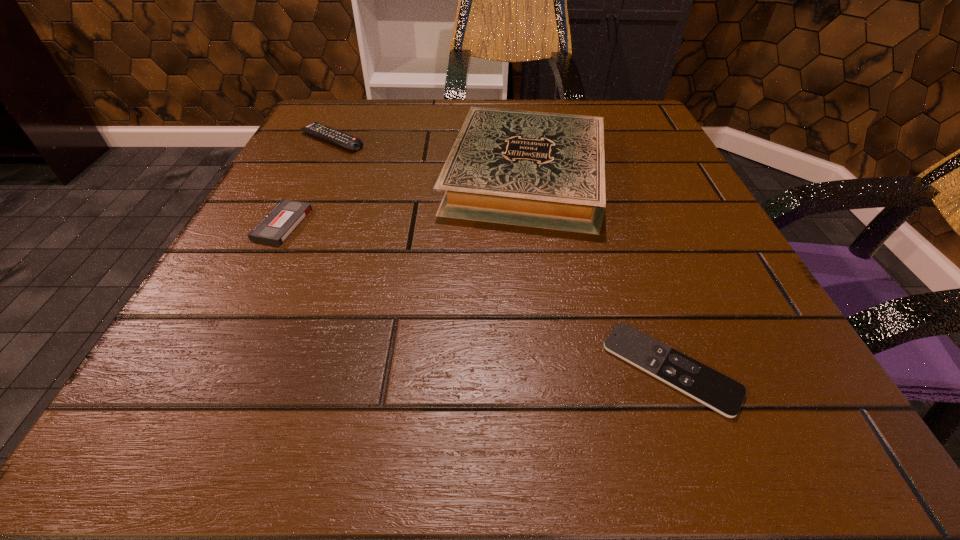
The image size is (960, 540). Identify the location of hardback book at the far edge. (545, 170).

The height and width of the screenshot is (540, 960). Find the location of `remote control that is at the far edge`. remote control that is at the far edge is located at coordinates (346, 141).

The height and width of the screenshot is (540, 960). What are the coordinates of `object present at the near edge` in the screenshot? It's located at (713, 389).

Locate an element on the screen. The image size is (960, 540). remote control located at the left edge is located at coordinates (346, 141).

At what (x,y) coordinates should I click in order to perform the action: click on videotape that is at the left edge. Please return your answer as a coordinate pair (x, y). This screenshot has height=540, width=960. Looking at the image, I should click on click(283, 219).

At what (x,y) coordinates should I click in order to perform the action: click on hardback book that is at the right edge. Please return your answer as a coordinate pair (x, y). Looking at the image, I should click on pyautogui.click(x=545, y=170).

Locate an element on the screen. The width and height of the screenshot is (960, 540). remote control positioned at the right edge is located at coordinates (713, 389).

Where is `object present at the far left corner`? Image resolution: width=960 pixels, height=540 pixels. object present at the far left corner is located at coordinates (346, 141).

Locate an element on the screen. Image resolution: width=960 pixels, height=540 pixels. object situated at the far right corner is located at coordinates (545, 170).

Identify the location of object that is positioned at the near right corner. (713, 389).